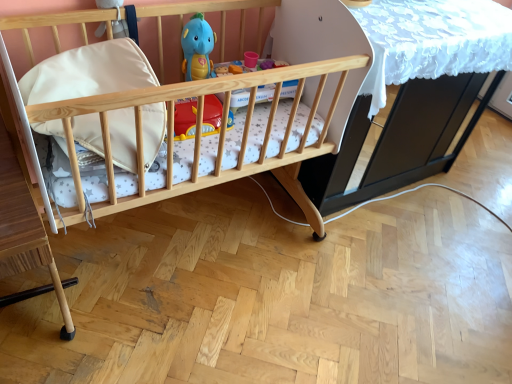
Question: Can you confirm if natural wood crib at center is wider than white lace table at center?

Choices:
 (A) yes
 (B) no

Answer: (A)

Question: Considering the relative positions of natural wood crib at center and white lace table at center in the image provided, is natural wood crib at center to the left of white lace table at center from the viewer's perspective?

Choices:
 (A) no
 (B) yes

Answer: (B)

Question: Does natural wood crib at center have a lesser width compared to white lace table at center?

Choices:
 (A) no
 (B) yes

Answer: (A)

Question: From the image's perspective, is natural wood crib at center over white lace table at center?

Choices:
 (A) yes
 (B) no

Answer: (B)

Question: Is natural wood crib at center positioned beyond the bounds of white lace table at center?

Choices:
 (A) yes
 (B) no

Answer: (A)

Question: From a real-world perspective, is white lace table at center above or below matte blue plush toy at upper center?

Choices:
 (A) above
 (B) below

Answer: (B)

Question: Is white lace table at center in front of or behind matte blue plush toy at upper center in the image?

Choices:
 (A) front
 (B) behind

Answer: (A)

Question: From the image's perspective, relative to matte blue plush toy at upper center, is white lace table at center above or below?

Choices:
 (A) above
 (B) below

Answer: (B)

Question: Is white lace table at center spatially inside matte blue plush toy at upper center, or outside of it?

Choices:
 (A) inside
 (B) outside

Answer: (B)

Question: From the image's perspective, is white lace table at center above or below white leather pillow at center?

Choices:
 (A) below
 (B) above

Answer: (B)

Question: From a real-world perspective, is white lace table at center above or below white leather pillow at center?

Choices:
 (A) above
 (B) below

Answer: (B)

Question: From their relative heights in the image, would you say white lace table at center is taller or shorter than white leather pillow at center?

Choices:
 (A) tall
 (B) short

Answer: (A)

Question: Would you say white lace table at center is to the left or to the right of white leather pillow at center in the picture?

Choices:
 (A) right
 (B) left

Answer: (A)

Question: Is natural wood crib at center bigger or smaller than white leather pillow at center?

Choices:
 (A) small
 (B) big

Answer: (B)

Question: From the image's perspective, is natural wood crib at center located above or below white leather pillow at center?

Choices:
 (A) above
 (B) below

Answer: (B)